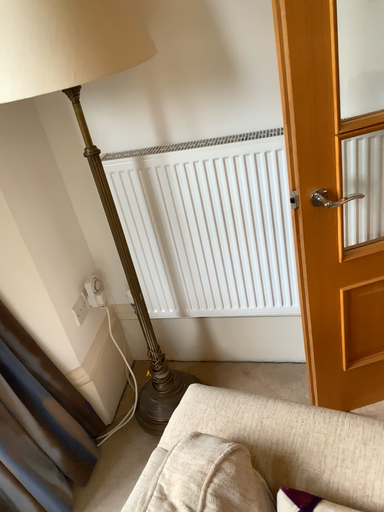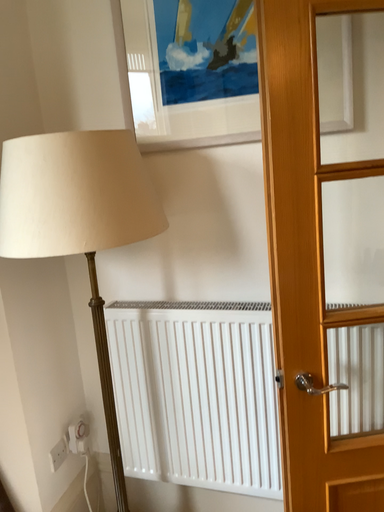
Question: How did the camera likely rotate when shooting the video?

Choices:
 (A) rotated downward
 (B) rotated upward

Answer: (B)